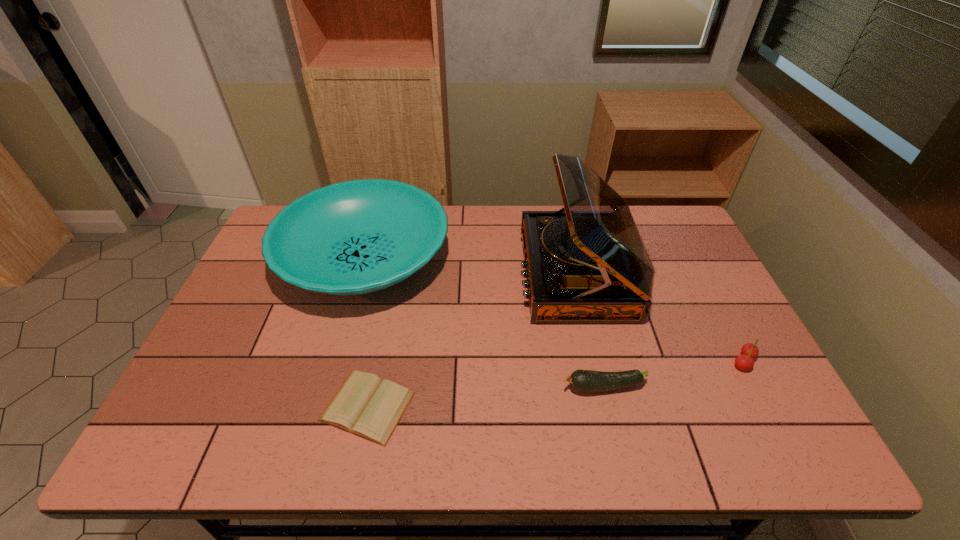
The height and width of the screenshot is (540, 960). I want to click on object present at the far left corner, so click(x=355, y=237).

Find the location of a particular element. This screenshot has width=960, height=540. free space at the near edge of the desktop is located at coordinates (712, 447).

Identify the location of vacant region at the left edge of the desktop. (267, 345).

Image resolution: width=960 pixels, height=540 pixels. In the image, there is a desktop. What are the coordinates of `vacant space at the right edge` in the screenshot? It's located at (723, 327).

This screenshot has width=960, height=540. I want to click on free region at the near left corner of the desktop, so click(x=228, y=446).

At what (x,y) coordinates should I click in order to perform the action: click on free space at the far right corner of the desktop. Please return your answer as a coordinate pair (x, y). This screenshot has height=540, width=960. Looking at the image, I should click on (684, 234).

Identify the location of free space between the shortest object and the fourth shortest object. Image resolution: width=960 pixels, height=540 pixels. (366, 332).

Find the location of a particular element. The width and height of the screenshot is (960, 540). unoccupied area between the shortest object and the rightmost object is located at coordinates (556, 384).

Where is `vacant point located between the third shortest object and the record player`? vacant point located between the third shortest object and the record player is located at coordinates (660, 318).

I want to click on vacant area between the diary and the record player, so click(x=471, y=340).